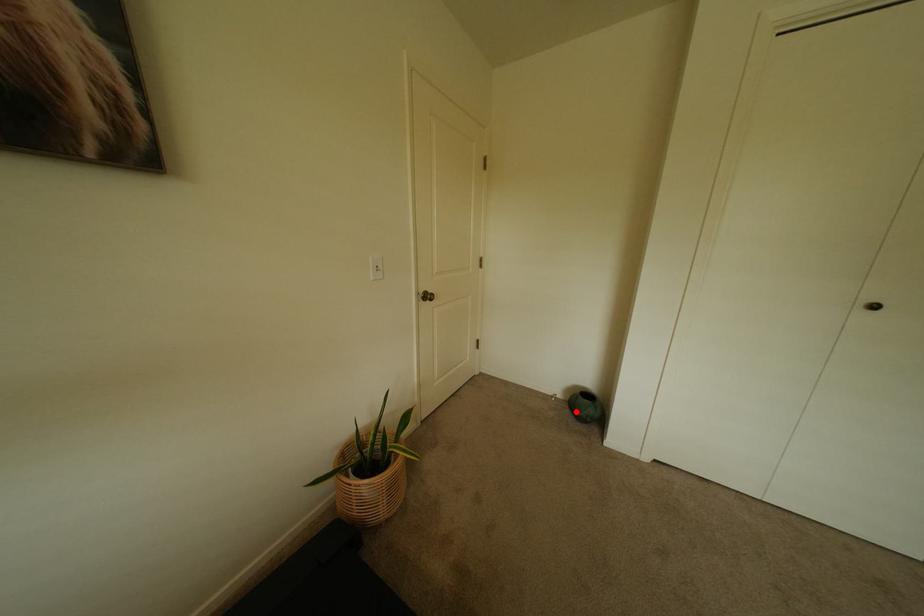
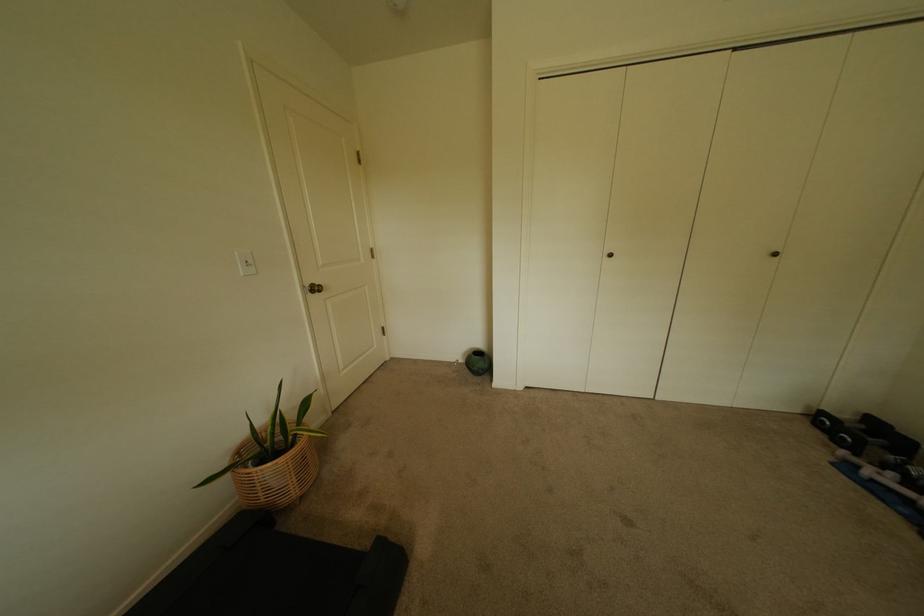
Question: A red point is marked in image1. In image2, is the corresponding 3D point closer to the camera or farther? Reply with the corresponding letter.

Choices:
 (A) The corresponding 3D point is closer.
 (B) The corresponding 3D point is farther.

Answer: (B)